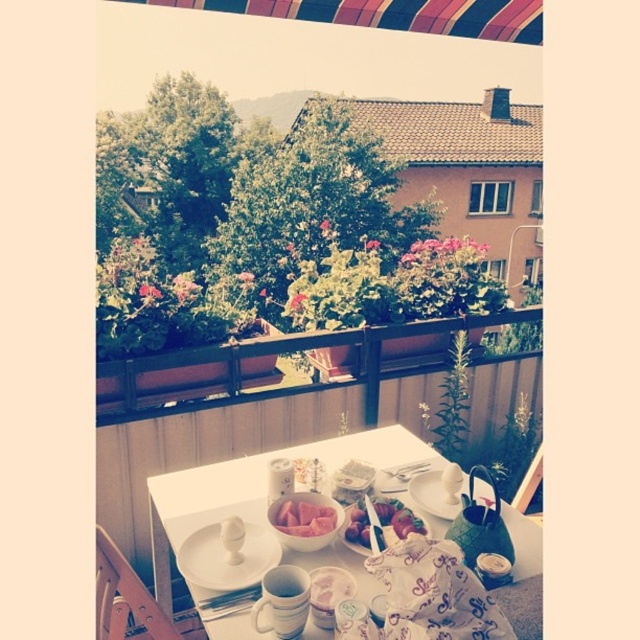
Question: Which object appears farthest from the camera in this image?

Choices:
 (A) white glossy plate at center
 (B) pink rubbery meat at center

Answer: (A)

Question: Which object is closer to the camera taking this photo?

Choices:
 (A) pink rubbery meat at center
 (B) white glossy platter at center
 (C) white glossy table at center
 (D) striped fabric canopy at upper center

Answer: (C)

Question: Can you confirm if white glossy table at center is positioned above white glossy platter at center?

Choices:
 (A) yes
 (B) no

Answer: (B)

Question: Estimate the real-world distances between objects in this image. Which object is closer to the white glossy plate at center?

Choices:
 (A) white glossy platter at center
 (B) white glossy table at center
 (C) striped fabric canopy at upper center
 (D) pink rubbery meat at center

Answer: (B)

Question: Is white glossy plate at center below pink rubbery meat at center?

Choices:
 (A) no
 (B) yes

Answer: (A)

Question: Observing the image, what is the correct spatial positioning of smooth pinkish-red fruit at center in reference to pink rubbery meat at center?

Choices:
 (A) above
 (B) below

Answer: (B)